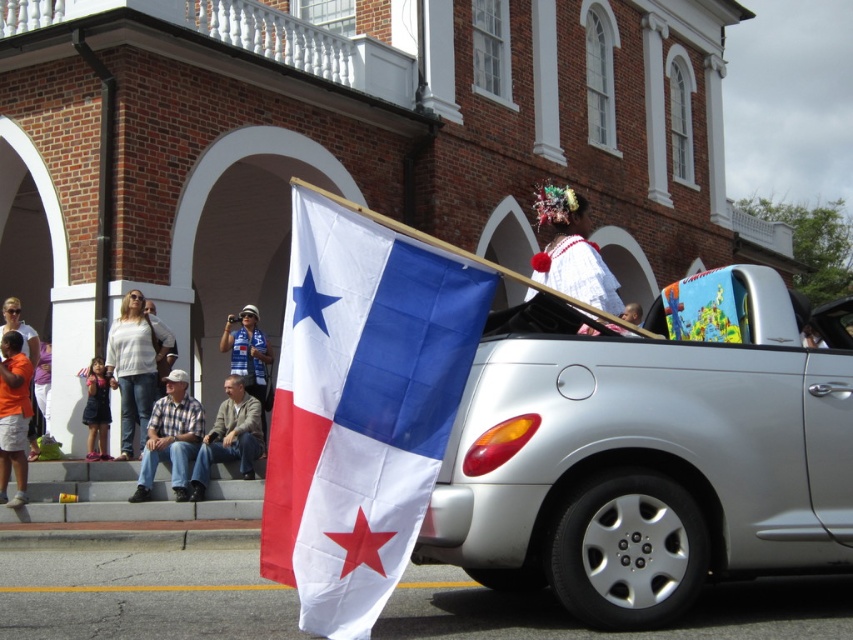
Does silver metallic car at center have a lesser height compared to orange cotton shirt at lower left?

No, silver metallic car at center is not shorter than orange cotton shirt at lower left.

Does silver metallic car at center have a smaller size compared to orange cotton shirt at lower left?

Actually, silver metallic car at center might be larger than orange cotton shirt at lower left.

The width and height of the screenshot is (853, 640). Identify the location of silver metallic car at center. (648, 460).

Who is higher up, white fabric headdress at upper center or white cotton shirt at left?

white fabric headdress at upper center

Between white fabric headdress at upper center and white cotton shirt at left, which one has less height?

Standing shorter between the two is white cotton shirt at left.

At what (x,y) coordinates should I click in order to perform the action: click on white fabric headdress at upper center. Please return your answer as a coordinate pair (x, y). This screenshot has width=853, height=640. Looking at the image, I should click on (572, 252).

At what (x,y) coordinates should I click in order to perform the action: click on white fabric headdress at upper center. Please return your answer as a coordinate pair (x, y). Looking at the image, I should click on pos(572,252).

Based on the photo, can you confirm if silver metallic car at center is smaller than light brown leather jacket at lower center?

No, silver metallic car at center is not smaller than light brown leather jacket at lower center.

Is silver metallic car at center positioned before light brown leather jacket at lower center?

Yes, silver metallic car at center is closer to the viewer.

Where is `silver metallic car at center`? This screenshot has width=853, height=640. silver metallic car at center is located at coordinates (648, 460).